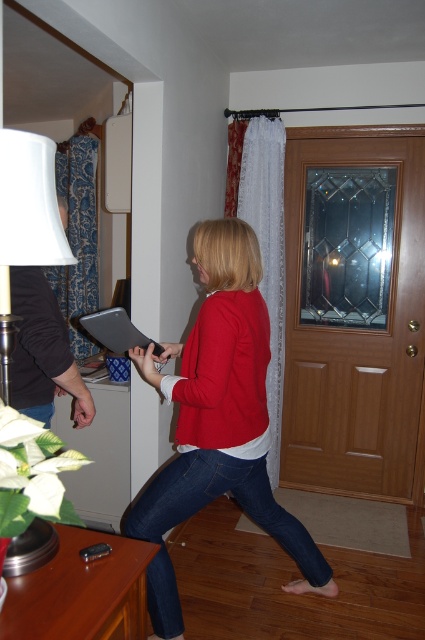
Question: Can you confirm if matte red sweater at center is positioned to the left of matte black clipboard at center?

Choices:
 (A) no
 (B) yes

Answer: (A)

Question: Which object is closer to the camera taking this photo?

Choices:
 (A) white fabric lampshade at left
 (B) matte red sweater at center

Answer: (A)

Question: Does matte red sweater at center have a greater width compared to matte black clipboard at center?

Choices:
 (A) yes
 (B) no

Answer: (A)

Question: Is matte red sweater at center wider than matte black clipboard at center?

Choices:
 (A) no
 (B) yes

Answer: (B)

Question: Which object appears closest to the camera in this image?

Choices:
 (A) matte red sweater at center
 (B) matte black clipboard at center

Answer: (A)

Question: Which of the following is the farthest from the observer?

Choices:
 (A) (209, 390)
 (B) (121, 317)
 (C) (34, 227)

Answer: (B)